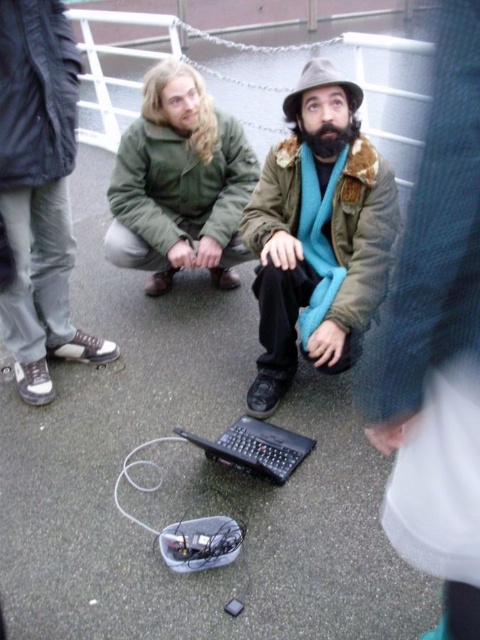
You are trying to determine if the black plastic laptop at center can fit into a carrying case designed for items narrower than the green matte jacket at center. Based on their widths, will it fit?

The black plastic laptop at center might be wider than green matte jacket at center, so it may not fit into the case designed for items narrower than the green matte jacket at center.

You are standing in the same location as the two people in the image. You want to pick up the black plastic laptop at center without moving the matte brown jacket at center. Is this possible?

The black plastic laptop at center is closer to the viewer than the matte brown jacket at center, so yes, you can pick it up without moving the jacket.